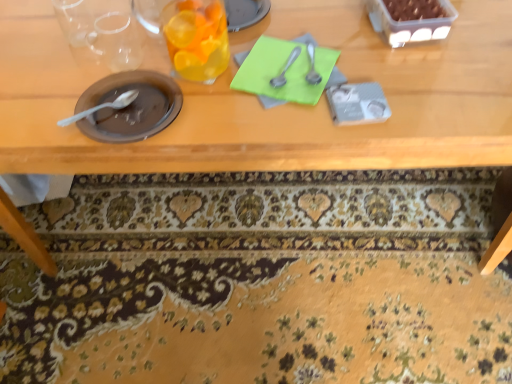
Identify the location of blank space situated above wooden table at center (from a real-world perspective). (234, 52).